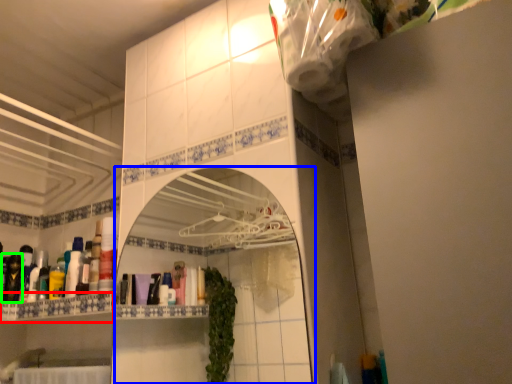
Question: Considering the real-world distances, which object is farthest from cabinet (highlighted by a red box)? mirror (highlighted by a blue box) or toiletry (highlighted by a green box)?

Choices:
 (A) mirror
 (B) toiletry

Answer: (A)